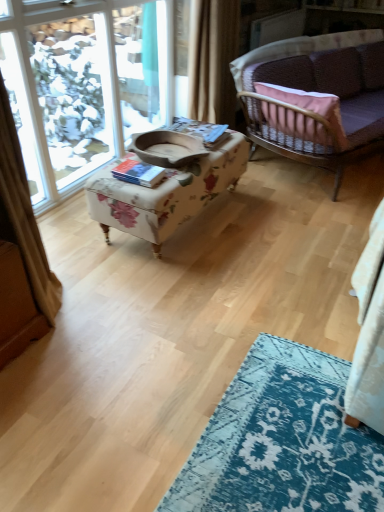
Question: Does beige fabric curtain at upper center have a lesser width compared to velvet purple couch at upper right?

Choices:
 (A) no
 (B) yes

Answer: (B)

Question: Can velvet purple couch at upper right be found inside beige fabric curtain at upper center?

Choices:
 (A) yes
 (B) no

Answer: (B)

Question: Is beige fabric curtain at upper center at the right side of velvet purple couch at upper right?

Choices:
 (A) yes
 (B) no

Answer: (B)

Question: Does beige fabric curtain at upper center turn towards velvet purple couch at upper right?

Choices:
 (A) yes
 (B) no

Answer: (A)

Question: Does beige fabric curtain at upper center lie behind velvet purple couch at upper right?

Choices:
 (A) yes
 (B) no

Answer: (A)

Question: From a real-world perspective, is beige fabric curtain at upper center located beneath velvet purple couch at upper right?

Choices:
 (A) no
 (B) yes

Answer: (A)

Question: Can you confirm if beige fabric curtain at upper center is bigger than clear glass window at upper left?

Choices:
 (A) yes
 (B) no

Answer: (B)

Question: Is beige fabric curtain at upper center facing away from clear glass window at upper left?

Choices:
 (A) yes
 (B) no

Answer: (A)

Question: Can you confirm if beige fabric curtain at upper center is smaller than clear glass window at upper left?

Choices:
 (A) no
 (B) yes

Answer: (B)

Question: From a real-world perspective, is beige fabric curtain at upper center physically above clear glass window at upper left?

Choices:
 (A) yes
 (B) no

Answer: (A)

Question: Is beige fabric curtain at upper center taller than clear glass window at upper left?

Choices:
 (A) yes
 (B) no

Answer: (B)

Question: Is clear glass window at upper left surrounded by beige fabric curtain at upper center?

Choices:
 (A) yes
 (B) no

Answer: (B)

Question: From the image's perspective, is velvet purple couch at upper right on floral fabric ottoman at center?

Choices:
 (A) no
 (B) yes

Answer: (B)